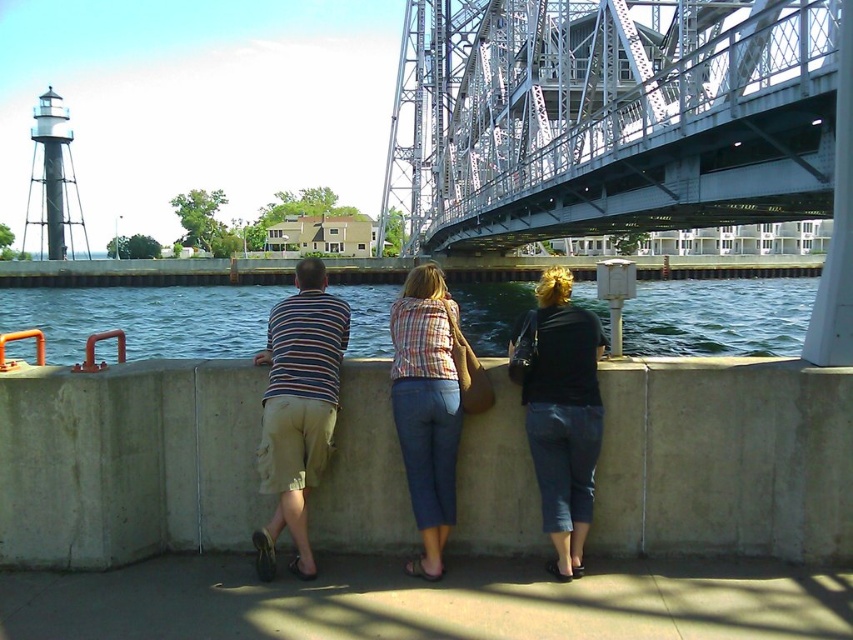
You are standing at the waterfront and want to take a photo of the gray metallic bridge at upper center. If your camera can focus on objects up to 15 meters away, will it be able to capture the bridge clearly?

The gray metallic bridge at upper center is 14.84 meters away from the camera, which is within the camera focus range of up to 15 meters. Therefore, the camera can capture the bridge clearly.

You are trying to locate the striped fabric shorts at center in a group of people leaning against a concrete barrier. Which direction should you look relative to the black denim jeans at center?

You should look to the left of the black denim jeans at center to find the striped fabric shorts at center, since the black denim jeans at center is positioned to the right of the striped fabric shorts at center.

From the picture: You are trying to determine which clothing item takes up more visual space in the image. The striped fabric shorts at center and the plaid shirt at center are both visible. Which one appears bigger?

The striped fabric shorts at center is larger in size than the plaid shirt at center, so the striped fabric shorts at center appears bigger.